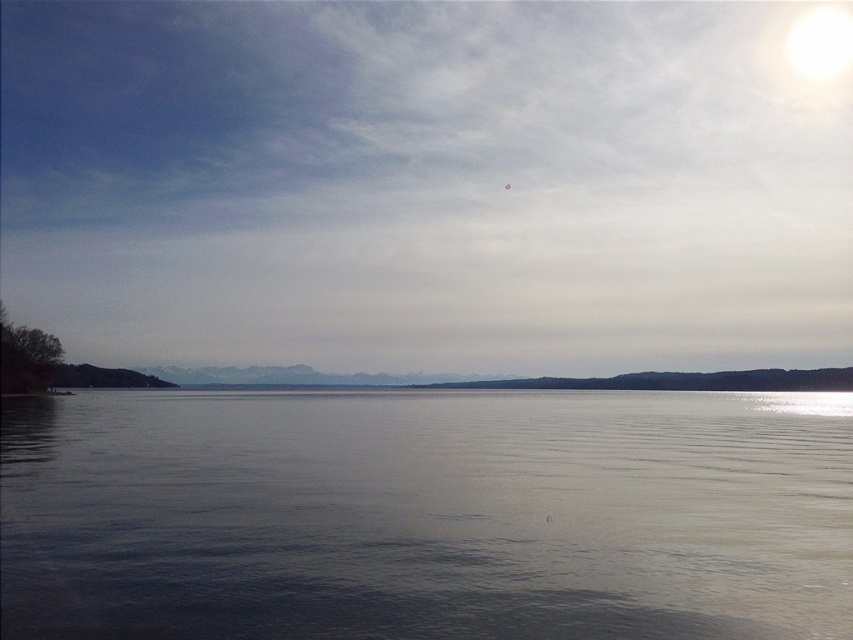
You are an artist planning to paint the scene. You want to ensure the matte white sky at upper center and the smooth gray water at center are proportionally accurate. Which object should you make taller in your painting?

The matte white sky at upper center should be made taller than the smooth gray water at center because the description states that the matte white sky at upper center is much taller as smooth gray water at center.

In the scene shown: You are standing at the lakeside and see two points marked on the image. The first point is at coordinates point (x=115, y=196) and the second is at point (x=457, y=580). Which point is closer to you from your current position?

Point (x=457, y=580) is closer to you because the description states that point (x=115, y=196) is behind point (x=457, y=580).

You are standing at the lakeside and looking at the scene. There is a point marked at coordinates (424, 184). What object or feature is located at that point?

The point at coordinates (424, 184) indicates the matte white sky at upper center.